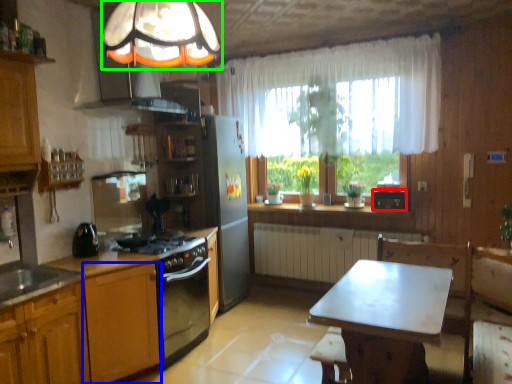
Question: Which object is positioned closest to appliance (highlighted by a red box)? Select from cabinetry (highlighted by a blue box) and fixture (highlighted by a green box).

Choices:
 (A) cabinetry
 (B) fixture

Answer: (A)